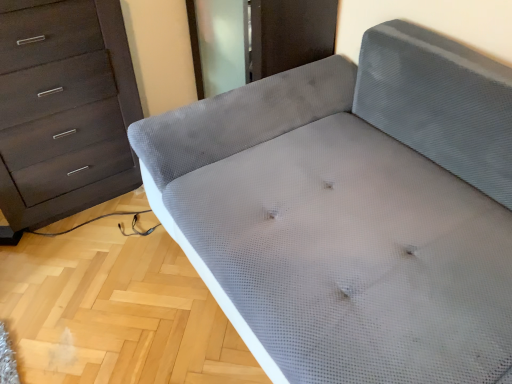
You are a GUI agent. You are given a task and a screenshot of the screen. Output one action in this format:
    pyautogui.click(x=<x>, y=<y>)
    Task: Click on the free space in front of matte dark brown chest of drawers at left
    
    Given the screenshot: What is the action you would take?
    pyautogui.click(x=78, y=276)